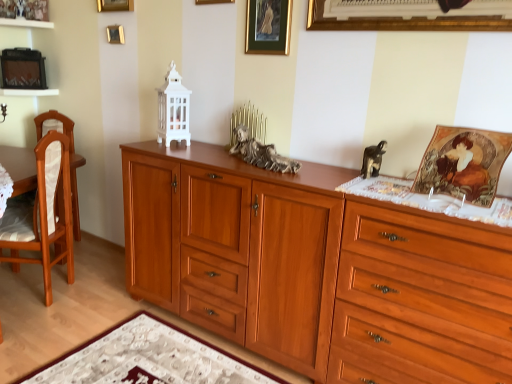
The width and height of the screenshot is (512, 384). What are the coordinates of `empty space that is to the right of light brown wood chair at left` in the screenshot? It's located at click(92, 297).